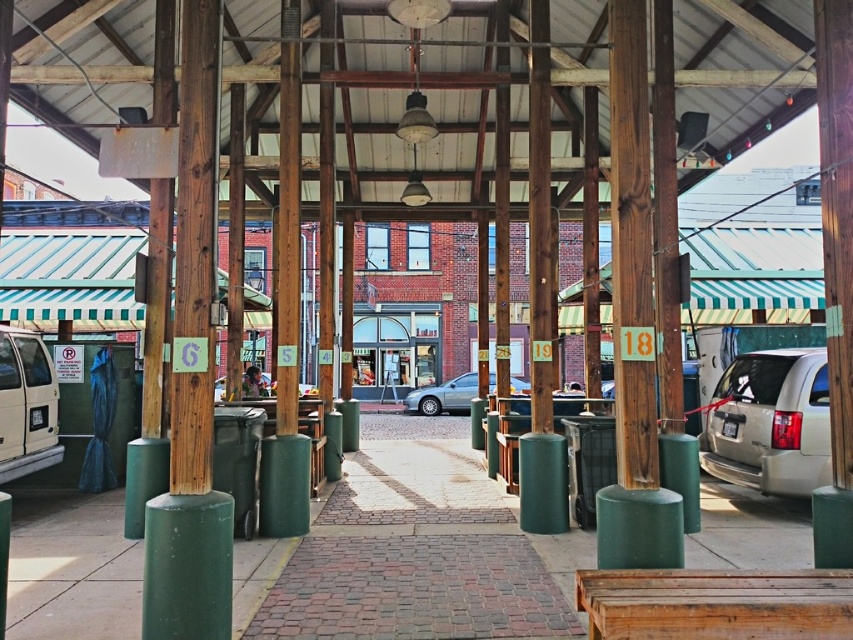
Is brick pavement at center above matte white van at left?

No.

Does brick pavement at center have a lesser height compared to matte white van at left?

Yes.

The width and height of the screenshot is (853, 640). In order to click on brick pavement at center in this screenshot , I will do coord(410,552).

Between brick pavement at center and satin silver sedan at center, which one has less height?

brick pavement at center

Locate an element on the screen. The image size is (853, 640). brick pavement at center is located at coordinates (410, 552).

Is point (776, 492) farther from camera compared to point (51, 396)?

No, it is not.

Which is more to the left, silver metallic minivan at right or matte white van at left?

matte white van at left

Is point (729, 468) farther from camera compared to point (47, 380)?

No, (729, 468) is in front of (47, 380).

Identify the location of silver metallic minivan at right. This screenshot has width=853, height=640. (770, 422).